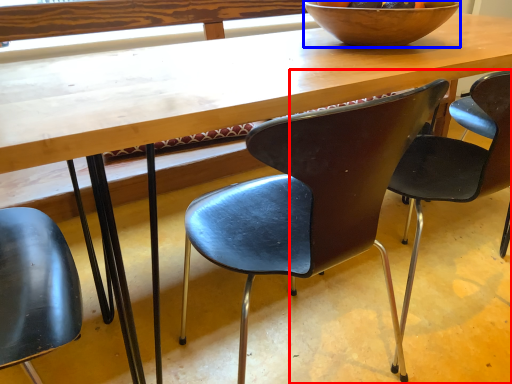
Question: Among these objects, which one is farthest to the camera, chair (highlighted by a red box) or bowl (highlighted by a blue box)?

Choices:
 (A) chair
 (B) bowl

Answer: (B)